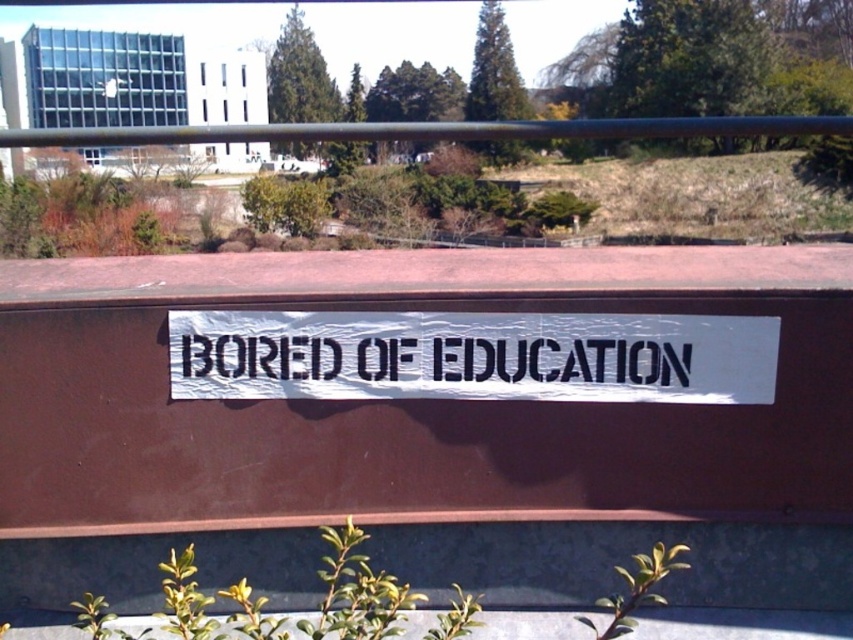
Which is below, white paper sign at center or black metal rail at upper center?

Positioned lower is white paper sign at center.

Does white paper sign at center appear under black metal rail at upper center?

Correct, white paper sign at center is located below black metal rail at upper center.

Find the location of `white paper sign at center`. white paper sign at center is located at coordinates (473, 355).

This screenshot has width=853, height=640. I want to click on white paper sign at center, so click(x=473, y=355).

Can you confirm if white paper sign at center is shorter than black paper at center?

No, white paper sign at center is not shorter than black paper at center.

Can you confirm if white paper sign at center is bigger than black paper at center?

Yes.

The width and height of the screenshot is (853, 640). Describe the element at coordinates (473, 355) in the screenshot. I see `white paper sign at center` at that location.

Find the location of `white paper sign at center`. white paper sign at center is located at coordinates (473, 355).

Does black paper at center appear on the left side of black metal rail at upper center?

Incorrect, black paper at center is not on the left side of black metal rail at upper center.

From the picture: Is black paper at center shorter than black metal rail at upper center?

Correct, black paper at center is not as tall as black metal rail at upper center.

The width and height of the screenshot is (853, 640). I want to click on black paper at center, so click(428, 360).